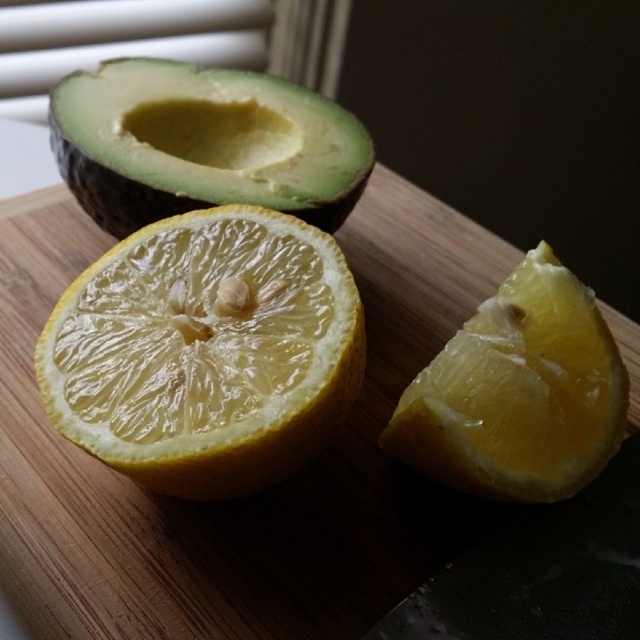
Can you confirm if translucent yellow orange at center is smaller than yellow matte lemon at center?

Incorrect, translucent yellow orange at center is not smaller in size than yellow matte lemon at center.

Which is more to the left, translucent yellow orange at center or yellow matte lemon at center?

translucent yellow orange at center is more to the left.

You are a GUI agent. You are given a task and a screenshot of the screen. Output one action in this format:
    pyautogui.click(x=<x>, y=<y>)
    Task: Click on the translucent yellow orange at center
    Image resolution: width=640 pixels, height=640 pixels.
    Given the screenshot: What is the action you would take?
    pyautogui.click(x=205, y=352)

Is point (362, 611) more distant than point (260, 150)?

No.

Which is in front, point (456, 262) or point (120, 161)?

Point (120, 161) is more forward.

Identify the location of wooden cutting board at center. The width and height of the screenshot is (640, 640). (244, 497).

Which is more to the left, wooden cutting board at center or yellow matte lemon at center?

wooden cutting board at center

Can you confirm if wooden cutting board at center is positioned to the right of yellow matte lemon at center?

In fact, wooden cutting board at center is to the left of yellow matte lemon at center.

From the picture: Who is more distant from viewer, [88,236] or [522,472]?

Positioned behind is point [88,236].

At what (x,y) coordinates should I click in order to perform the action: click on wooden cutting board at center. Please return your answer as a coordinate pair (x, y). The width and height of the screenshot is (640, 640). Looking at the image, I should click on (244, 497).